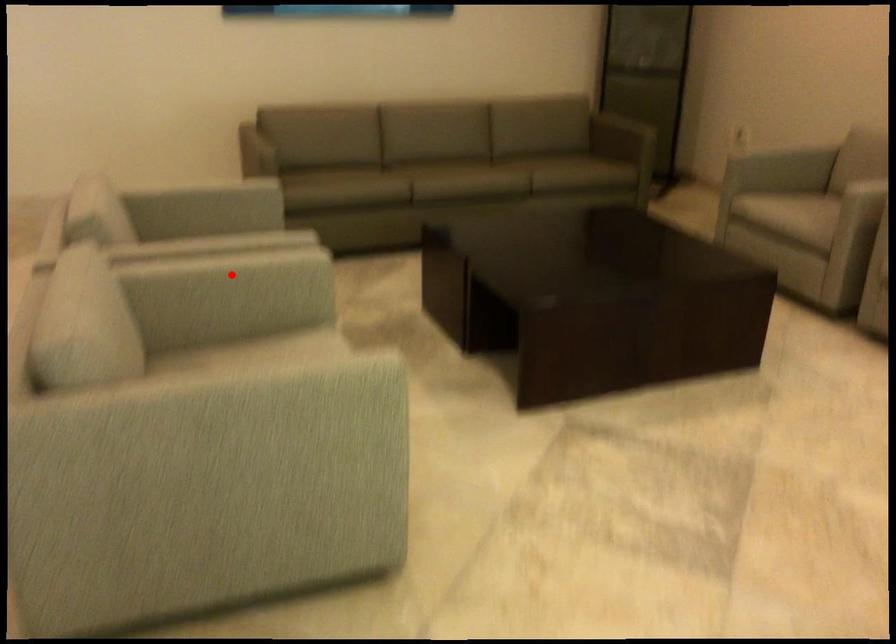
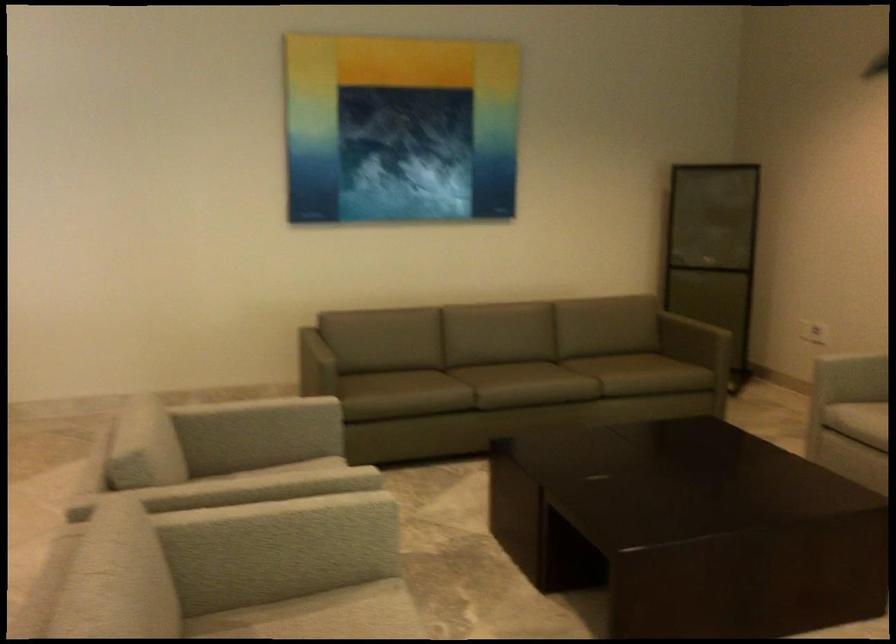
Find the pixel in the second image that matches the highlighted location in the first image.

(289, 529)